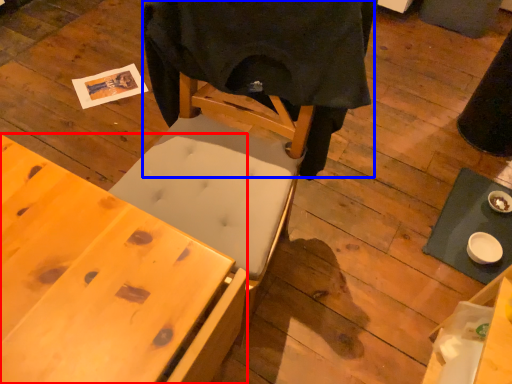
Question: Which of the following is the farthest to the observer, desk (highlighted by a red box) or cloth (highlighted by a blue box)?

Choices:
 (A) desk
 (B) cloth

Answer: (B)